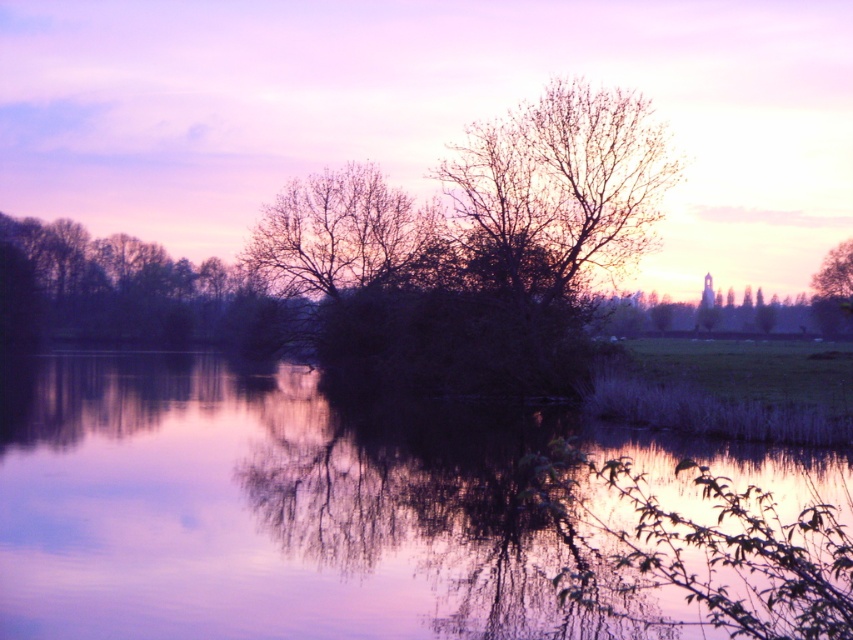
Question: In this image, where is silhouette bare tree at left located relative to green matte tree at upper right?

Choices:
 (A) above
 (B) below

Answer: (B)

Question: Can you confirm if silhouette bare tree at left is bigger than bare branches at center?

Choices:
 (A) no
 (B) yes

Answer: (B)

Question: Which object is the closest to the purple reflective water at center?

Choices:
 (A) bare branches at center
 (B) green matte tree at upper right
 (C) silhouette bare tree at left

Answer: (A)

Question: Among these objects, which one is farthest from the camera?

Choices:
 (A) silhouette bare tree at left
 (B) purple reflective water at center

Answer: (A)

Question: Which of the following is the closest to the observer?

Choices:
 (A) (202, 332)
 (B) (312, 234)
 (C) (822, 262)

Answer: (B)

Question: Does purple reflective water at center come in front of green matte tree at upper right?

Choices:
 (A) yes
 (B) no

Answer: (A)